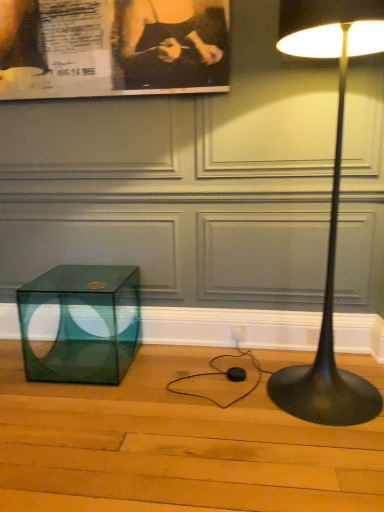
Identify the location of empty space that is to the right of transparent glass cube at lower left. (172, 384).